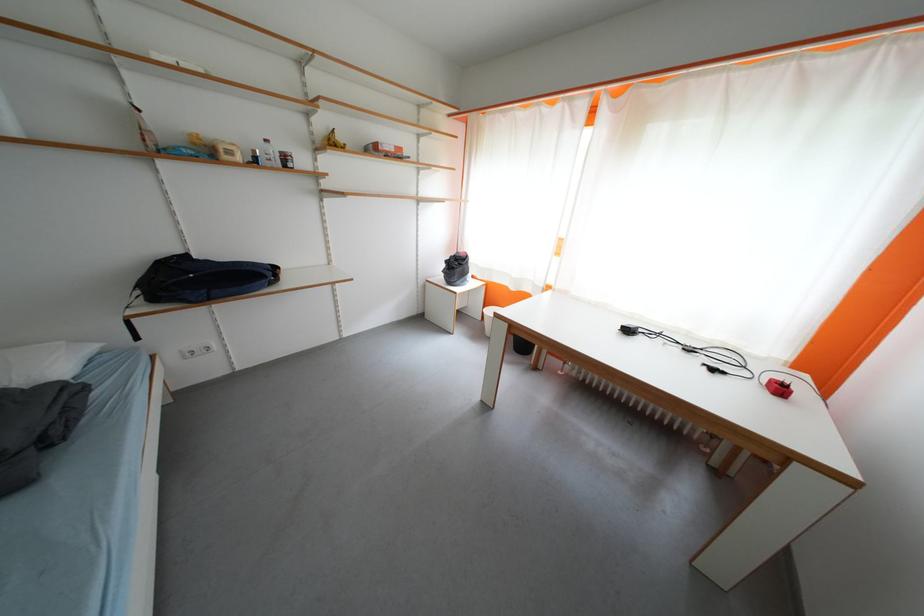
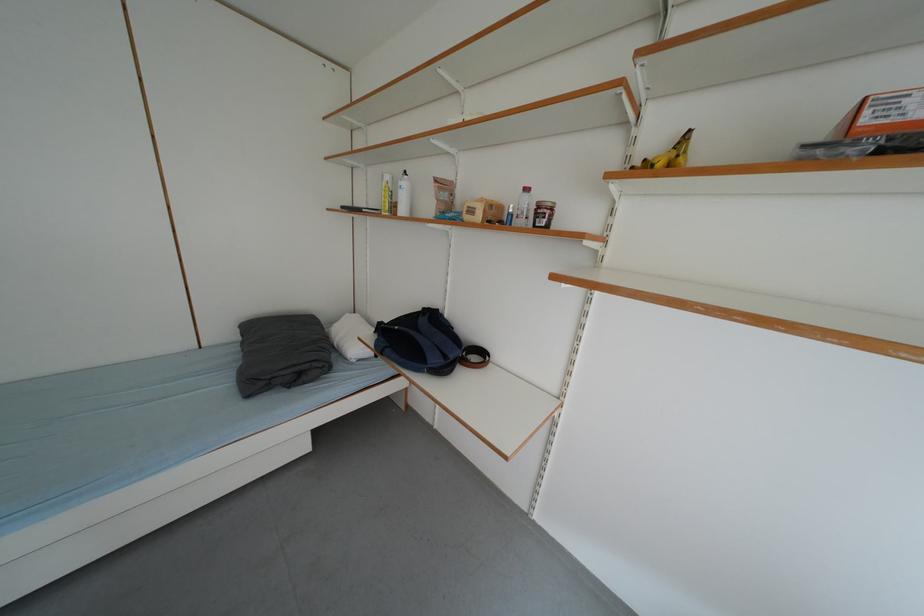
In the second image, find the point that corresponds to [247,161] in the first image.

(487, 220)